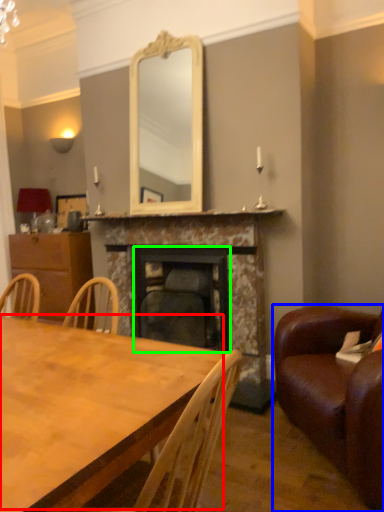
Question: Estimate the real-world distances between objects in this image. Which object is closer to table top (highlighted by a red box), studio couch (highlighted by a blue box) or fireplace (highlighted by a green box)?

Choices:
 (A) studio couch
 (B) fireplace

Answer: (A)